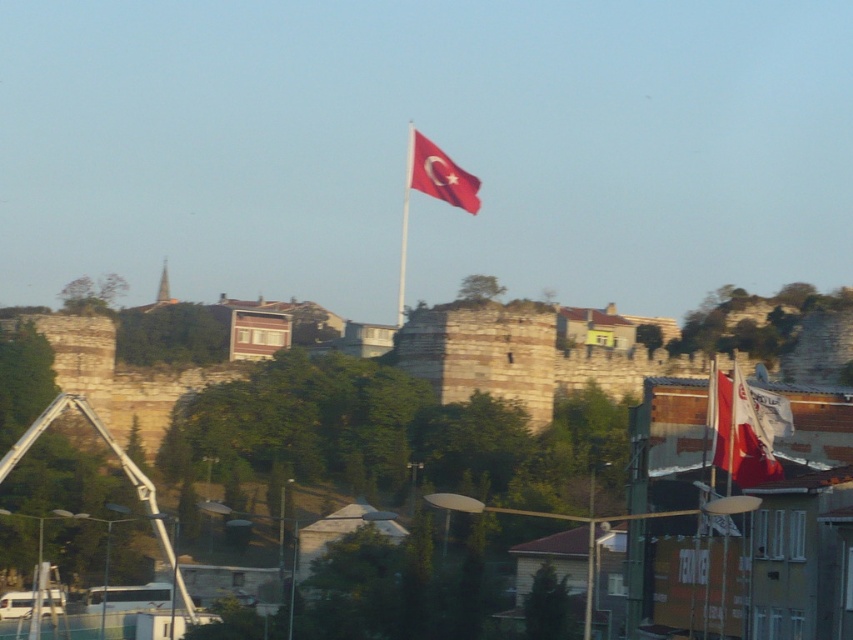
You are a photographer standing in front of the historical stone wall. You notice the red fabric flag at right and the red fabric flag pole at center. Which object is positioned closer to you?

The red fabric flag at right is closer to the viewer than the red fabric flag pole at center.

You are a photographer trying to capture both the red fabric flag at right and the red fabric flag at upper center in a single shot. Which flag will appear smaller in the photo?

The red fabric flag at right occupies less space than the red fabric flag at upper center, so it will appear smaller in the photo.

You are a photographer trying to capture both the red fabric flag at right and the red fabric flag at upper center in a single shot. Which flag should you position closer to the left side of your camera frame to include both in the composition?

You should position the red fabric flag at upper center closer to the left side of your camera frame because the red fabric flag at right is located to the right of it, ensuring both flags fit within the frame.